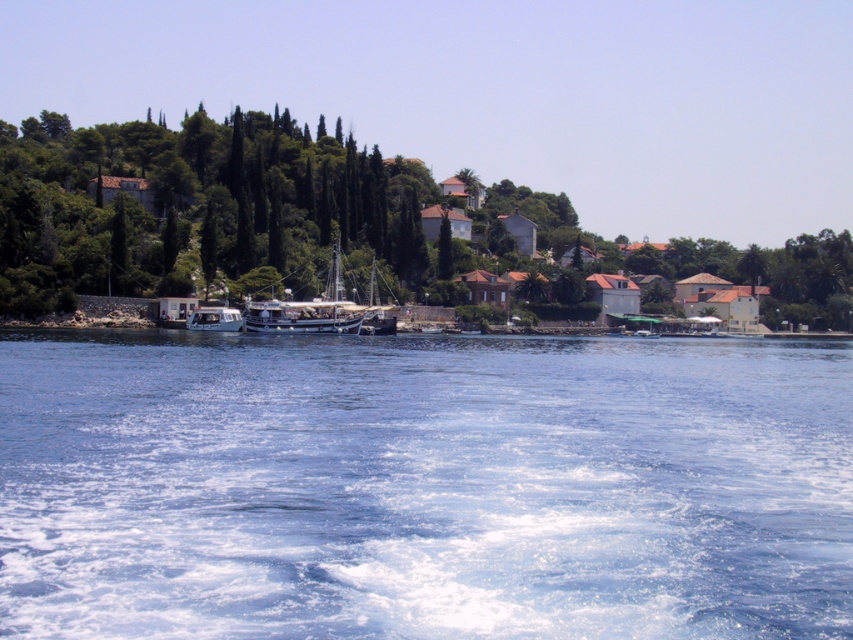
Who is more forward, (59, 381) or (419, 182)?

Point (59, 381) is more forward.

Can you confirm if blue liquid water at lower center is smaller than green leafy tree at center?

Indeed, blue liquid water at lower center has a smaller size compared to green leafy tree at center.

Measure the distance between point (425, 512) and camera.

The distance of point (425, 512) from camera is 15.60 meters.

Locate an element on the screen. This screenshot has height=640, width=853. blue liquid water at lower center is located at coordinates (422, 486).

The image size is (853, 640). What do you see at coordinates (314, 308) in the screenshot? I see `wooden sailboat at center` at bounding box center [314, 308].

Who is more forward, (x=334, y=321) or (x=216, y=317)?

Point (x=334, y=321)

Find the location of `wooden sailboat at center`. wooden sailboat at center is located at coordinates (314, 308).

Find the location of a particular element. The width and height of the screenshot is (853, 640). wooden sailboat at center is located at coordinates (314, 308).

Which is in front, point (834, 253) or point (274, 307)?

Point (274, 307)

I want to click on green leafy tree at center, so click(332, 225).

Between point (300, 177) and point (316, 304), which one is positioned in front?

Point (316, 304) is more forward.

Where is `green leafy tree at center`? green leafy tree at center is located at coordinates (332, 225).